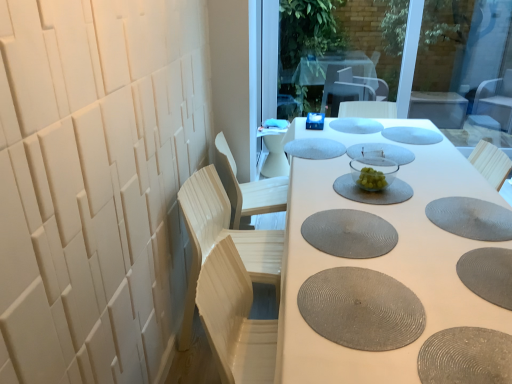
You are a GUI agent. You are given a task and a screenshot of the screen. Output one action in this format:
    pyautogui.click(x=<x>, y=<y>)
    Task: Click on the vacant space behind gray textured placemat at center, placed as the seventh manhole cover when sorted from back to front
    This screenshot has width=512, height=384.
    Given the screenshot: What is the action you would take?
    pyautogui.click(x=336, y=196)